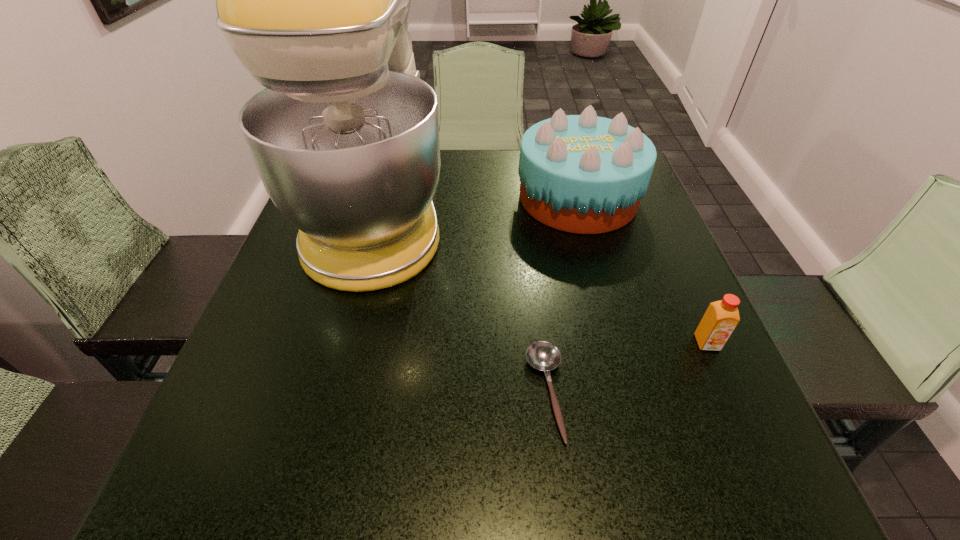
Identify the location of vacant area that lies between the ladle and the orange juice. This screenshot has width=960, height=540. (627, 368).

This screenshot has height=540, width=960. I want to click on object that is the second closest to the cake, so click(x=721, y=318).

Choose which object is the second nearest neighbor to the shortest object. Please provide its 2D coordinates. Your answer should be formatted as a tuple, i.e. [(x, y)], where the tuple contains the x and y coordinates of a point satisfying the conditions above.

[(721, 318)]

This screenshot has width=960, height=540. Find the location of `free point that satisfies the following two spatial constraints: 1. on the side of the ladle with the control knob; 2. on the left side of the leftmost object`. free point that satisfies the following two spatial constraints: 1. on the side of the ladle with the control knob; 2. on the left side of the leftmost object is located at coordinates (331, 393).

You are a GUI agent. You are given a task and a screenshot of the screen. Output one action in this format:
    pyautogui.click(x=<x>, y=<y>)
    Task: Click on the free spot that satisfies the following two spatial constraints: 1. on the front side of the cake; 2. on the side of the leftmost object with the control knob
    The width and height of the screenshot is (960, 540).
    Given the screenshot: What is the action you would take?
    pyautogui.click(x=582, y=212)

The height and width of the screenshot is (540, 960). I want to click on free space that satisfies the following two spatial constraints: 1. on the back side of the ladle; 2. on the side of the tallest object with the control knob, so click(525, 212).

You are a GUI agent. You are given a task and a screenshot of the screen. Output one action in this format:
    pyautogui.click(x=<x>, y=<y>)
    Task: Click on the free space in the image that satisfies the following two spatial constraints: 1. on the side of the mixer with the control knob; 2. on the back side of the shortest object
    The width and height of the screenshot is (960, 540).
    Given the screenshot: What is the action you would take?
    pyautogui.click(x=331, y=393)